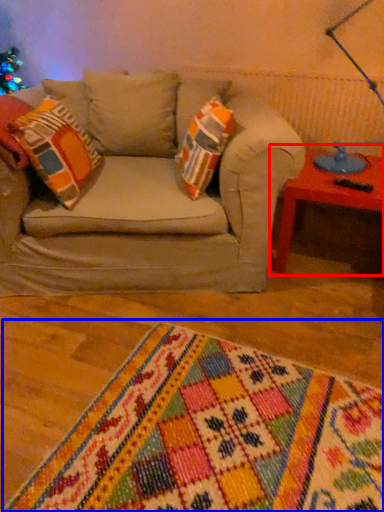
Question: Which object is further to the camera taking this photo, table (highlighted by a red box) or blanket (highlighted by a blue box)?

Choices:
 (A) table
 (B) blanket

Answer: (A)